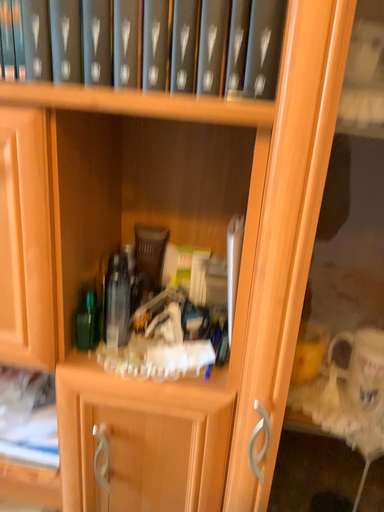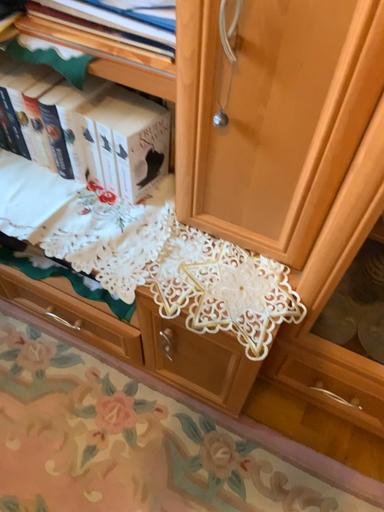
Question: How did the camera likely rotate when shooting the video?

Choices:
 (A) rotated downward
 (B) rotated upward

Answer: (A)